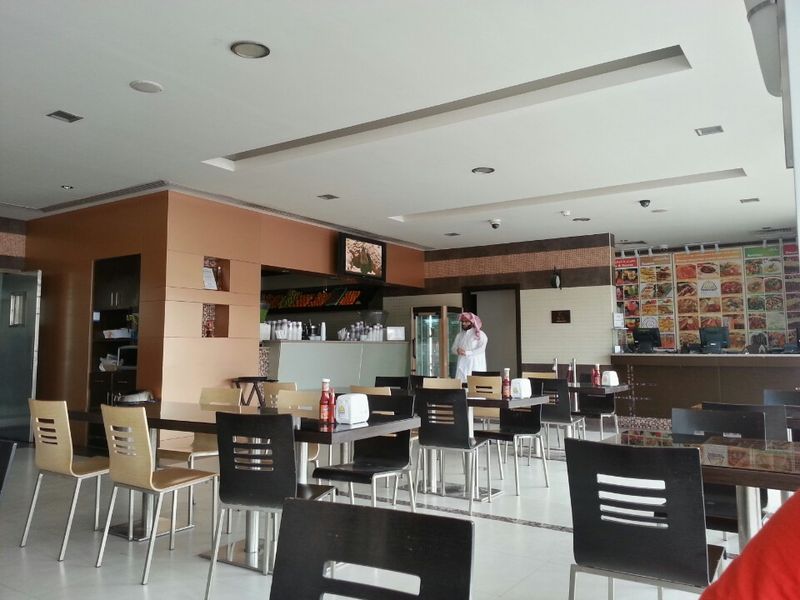
The width and height of the screenshot is (800, 600). I want to click on counter for ordering food, so click(652, 357), click(762, 363).